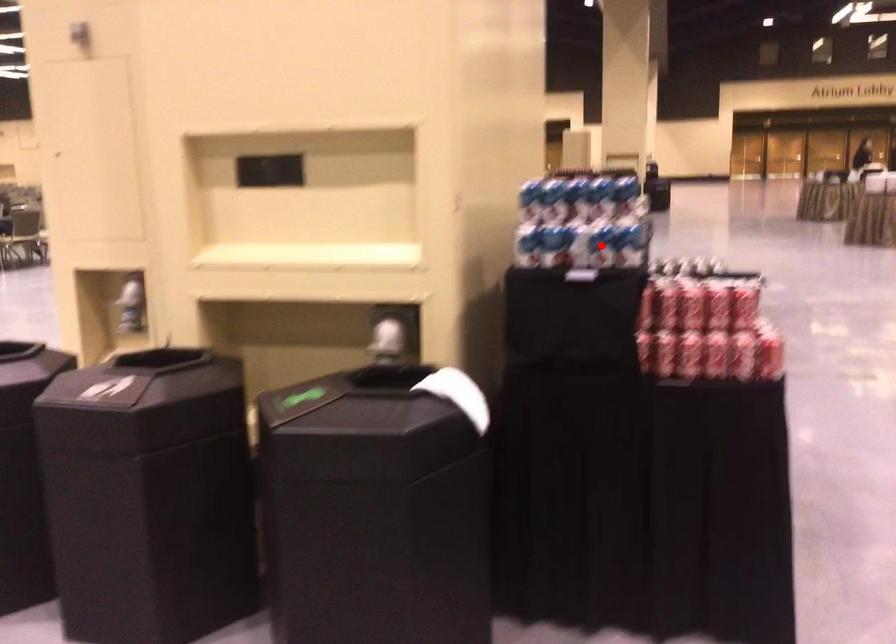
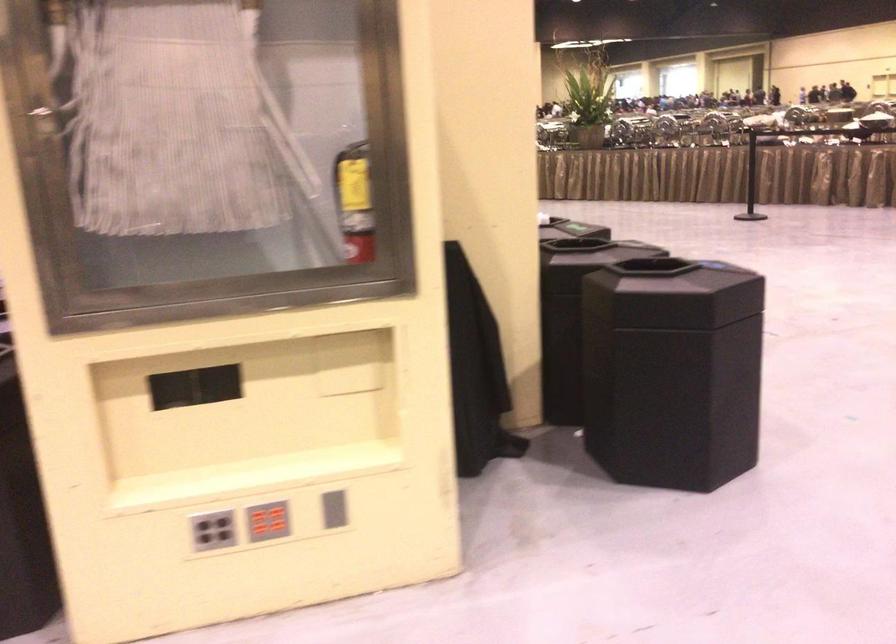
Question: I am providing you with two images of the same scene from different viewpoints. A red point is marked on the first image. At the location where the point appears in image 1, is it still visible in image 2?

Choices:
 (A) Yes
 (B) No

Answer: (B)